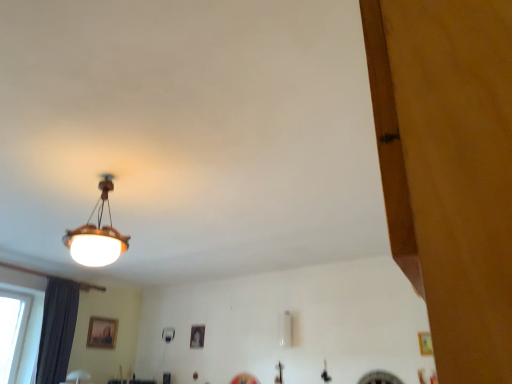
What do you see at coordinates (57, 330) in the screenshot? This screenshot has width=512, height=384. I see `dark gray fabric curtain at left` at bounding box center [57, 330].

Where is `dark gray fabric curtain at left`? The width and height of the screenshot is (512, 384). dark gray fabric curtain at left is located at coordinates (57, 330).

Image resolution: width=512 pixels, height=384 pixels. What do you see at coordinates (97, 235) in the screenshot? I see `matte wooden lampshade at upper left` at bounding box center [97, 235].

You are a GUI agent. You are given a task and a screenshot of the screen. Output one action in this format:
    pyautogui.click(x=<x>, y=<y>)
    Task: Click on the matte black picture frame at center, which appears as the 1th picture frame when viewed from the right
    The image size is (512, 384).
    Given the screenshot: What is the action you would take?
    pyautogui.click(x=197, y=336)

Which is closer to the camera, (59,370) or (109,243)?

Positioned in front is point (109,243).

Can you confirm if dark gray fabric curtain at left is wider than matte wooden lampshade at upper left?

No.

Considering the sizes of dark gray fabric curtain at left and matte wooden lampshade at upper left in the image, is dark gray fabric curtain at left taller or shorter than matte wooden lampshade at upper left?

dark gray fabric curtain at left is taller than matte wooden lampshade at upper left.

Is dark gray fabric curtain at left at the right side of matte wooden lampshade at upper left?

No.

Starting from the dark gray fabric curtain at left, which picture frame is the 2nd one to the right? Please provide its 2D coordinates.

[(197, 336)]

Does matte black picture frame at center, which appears as the 1th picture frame when viewed from the right, have a greater height compared to dark gray fabric curtain at left?

In fact, matte black picture frame at center, which appears as the 1th picture frame when viewed from the right, may be shorter than dark gray fabric curtain at left.

Between matte black picture frame at center, which appears as the 1th picture frame when viewed from the right, and dark gray fabric curtain at left, which one has larger width?

dark gray fabric curtain at left is wider.

Between matte wooden lampshade at upper left and dark gray fabric curtain at left, which one has smaller size?

With smaller size is matte wooden lampshade at upper left.

Identify the location of lamp in front of the dark gray fabric curtain at left. (97, 235).

Considering the points (106, 263) and (65, 374), which point is behind, point (106, 263) or point (65, 374)?

Positioned behind is point (65, 374).

Based on the photo, considering the sizes of objects wooden picture frame at lower center, which is the first picture frame in left-to-right order, and dark gray fabric curtain at left in the image provided, who is bigger, wooden picture frame at lower center, which is the first picture frame in left-to-right order, or dark gray fabric curtain at left?

dark gray fabric curtain at left.

Which object is further away from the camera taking this photo, wooden picture frame at lower center, which is the second picture frame in right-to-left order, or dark gray fabric curtain at left?

wooden picture frame at lower center, which is the second picture frame in right-to-left order, is behind.

Is wooden picture frame at lower center, which is the first picture frame in left-to-right order, aimed at dark gray fabric curtain at left?

No, wooden picture frame at lower center, which is the first picture frame in left-to-right order, does not turn towards dark gray fabric curtain at left.

Can you confirm if wooden picture frame at lower center, which is the first picture frame in left-to-right order, is taller than dark gray fabric curtain at left?

No, wooden picture frame at lower center, which is the first picture frame in left-to-right order, is not taller than dark gray fabric curtain at left.

From a real-world perspective, is dark gray fabric curtain at left positioned under matte black picture frame at center, the 2th picture frame in the left-to-right sequence, based on gravity?

Yes, from a real-world perspective, dark gray fabric curtain at left is beneath matte black picture frame at center, the 2th picture frame in the left-to-right sequence.

Which object is further away from the camera, dark gray fabric curtain at left or matte black picture frame at center, which appears as the 1th picture frame when viewed from the right?

Positioned behind is matte black picture frame at center, which appears as the 1th picture frame when viewed from the right.

Is point (69, 298) closer or farther from the camera than point (191, 331)?

Point (69, 298).

Looking at the image, does dark gray fabric curtain at left seem bigger or smaller compared to matte black picture frame at center, the 2th picture frame in the left-to-right sequence?

Clearly, dark gray fabric curtain at left is larger in size than matte black picture frame at center, the 2th picture frame in the left-to-right sequence.

Measure the distance from matte black picture frame at center, which appears as the 1th picture frame when viewed from the right, to wooden picture frame at lower center, which is the first picture frame in left-to-right order.

1.41 meters.

Is matte black picture frame at center, which appears as the 1th picture frame when viewed from the right, next to wooden picture frame at lower center, which is the second picture frame in right-to-left order, and touching it?

No, matte black picture frame at center, which appears as the 1th picture frame when viewed from the right, is not beside wooden picture frame at lower center, which is the second picture frame in right-to-left order.

Considering the sizes of objects matte black picture frame at center, which appears as the 1th picture frame when viewed from the right, and wooden picture frame at lower center, which is the first picture frame in left-to-right order, in the image provided, who is wider, matte black picture frame at center, which appears as the 1th picture frame when viewed from the right, or wooden picture frame at lower center, which is the first picture frame in left-to-right order,?

wooden picture frame at lower center, which is the first picture frame in left-to-right order, is wider.

In the scene shown: Which object is positioned more to the left, matte wooden lampshade at upper left or matte black picture frame at center, the 2th picture frame in the left-to-right sequence?

From the viewer's perspective, matte wooden lampshade at upper left appears more on the left side.

I want to click on lamp above the matte black picture frame at center, which appears as the 1th picture frame when viewed from the right (from a real-world perspective), so click(x=97, y=235).

From the image's perspective, is matte wooden lampshade at upper left beneath matte black picture frame at center, the 2th picture frame in the left-to-right sequence?

No.

Consider the image. Measure the distance from matte wooden lampshade at upper left to matte black picture frame at center, which appears as the 1th picture frame when viewed from the right.

matte wooden lampshade at upper left is 9.05 feet from matte black picture frame at center, which appears as the 1th picture frame when viewed from the right.

The width and height of the screenshot is (512, 384). Identify the location of lamp that is in front of the dark gray fabric curtain at left. (97, 235).

At what (x,y) coordinates should I click in order to perform the action: click on curtain above the matte black picture frame at center, the 2th picture frame in the left-to-right sequence (from the image's perspective). Please return your answer as a coordinate pair (x, y). Image resolution: width=512 pixels, height=384 pixels. Looking at the image, I should click on (57, 330).

Based on the photo, when comparing their distances from matte wooden lampshade at upper left, does dark gray fabric curtain at left or wooden picture frame at lower center, which is the first picture frame in left-to-right order, seem further?

wooden picture frame at lower center, which is the first picture frame in left-to-right order, is positioned further to the anchor matte wooden lampshade at upper left.

Which object lies further to the anchor point matte black picture frame at center, which appears as the 1th picture frame when viewed from the right, dark gray fabric curtain at left or wooden picture frame at lower center, which is the second picture frame in right-to-left order?

The object further to matte black picture frame at center, which appears as the 1th picture frame when viewed from the right, is dark gray fabric curtain at left.

Based on the photo, which object lies further to the anchor point matte wooden lampshade at upper left, matte black picture frame at center, which appears as the 1th picture frame when viewed from the right, or wooden picture frame at lower center, which is the first picture frame in left-to-right order?

wooden picture frame at lower center, which is the first picture frame in left-to-right order, is positioned further to the anchor matte wooden lampshade at upper left.

Which object lies further to the anchor point dark gray fabric curtain at left, matte black picture frame at center, the 2th picture frame in the left-to-right sequence, or wooden picture frame at lower center, which is the second picture frame in right-to-left order?

Among the two, matte black picture frame at center, the 2th picture frame in the left-to-right sequence, is located further to dark gray fabric curtain at left.

Based on their spatial positions, is matte wooden lampshade at upper left or matte black picture frame at center, the 2th picture frame in the left-to-right sequence, further from wooden picture frame at lower center, which is the second picture frame in right-to-left order?

matte wooden lampshade at upper left.

Estimate the real-world distances between objects in this image. Which object is closer to dark gray fabric curtain at left, matte wooden lampshade at upper left or matte black picture frame at center, which appears as the 1th picture frame when viewed from the right?

Based on the image, matte black picture frame at center, which appears as the 1th picture frame when viewed from the right, appears to be nearer to dark gray fabric curtain at left.

Considering their positions, is dark gray fabric curtain at left positioned further to wooden picture frame at lower center, which is the first picture frame in left-to-right order, than matte black picture frame at center, which appears as the 1th picture frame when viewed from the right?

Among the two, dark gray fabric curtain at left is located further to wooden picture frame at lower center, which is the first picture frame in left-to-right order.

When comparing their distances from dark gray fabric curtain at left, does wooden picture frame at lower center, which is the first picture frame in left-to-right order, or matte wooden lampshade at upper left seem closer?

wooden picture frame at lower center, which is the first picture frame in left-to-right order, is closer to dark gray fabric curtain at left.

This screenshot has height=384, width=512. Identify the location of curtain positioned between matte wooden lampshade at upper left and wooden picture frame at lower center, which is the first picture frame in left-to-right order, from near to far. (57, 330).

This screenshot has width=512, height=384. Find the location of `picture frame between matte wooden lampshade at upper left and matte black picture frame at center, which appears as the 1th picture frame when viewed from the right, in the front-back direction`. picture frame between matte wooden lampshade at upper left and matte black picture frame at center, which appears as the 1th picture frame when viewed from the right, in the front-back direction is located at coordinates (102, 333).

The image size is (512, 384). Identify the location of picture frame between dark gray fabric curtain at left and matte black picture frame at center, which appears as the 1th picture frame when viewed from the right, from left to right. (102, 333).

Identify the location of curtain between matte wooden lampshade at upper left and matte black picture frame at center, which appears as the 1th picture frame when viewed from the right, along the z-axis. (57, 330).